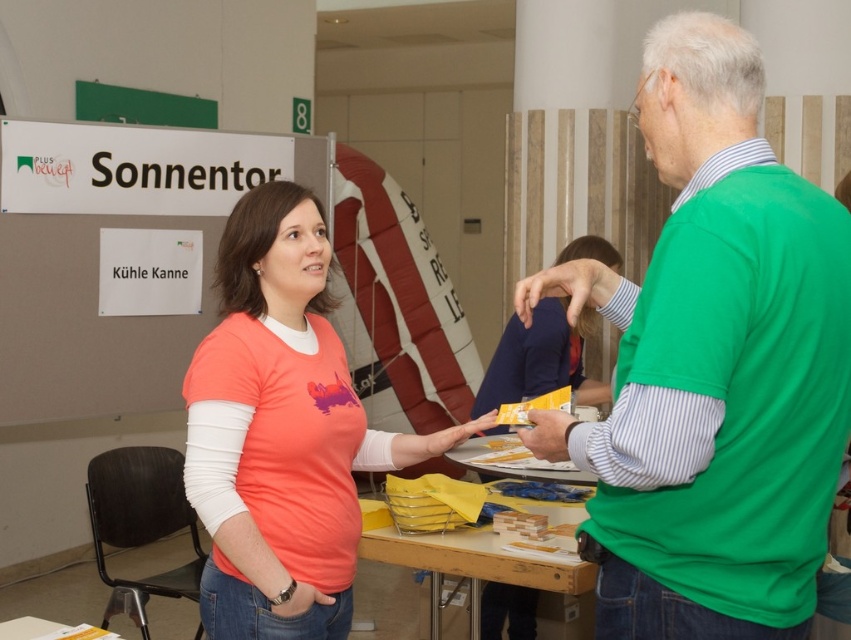
What are the coordinates of the matte green shirt at center in the image?

The coordinates of the matte green shirt at center are at point (540,358).